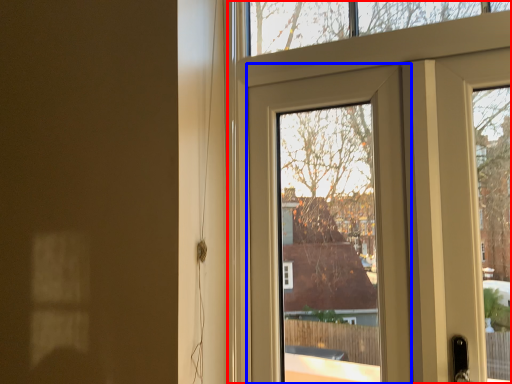
Question: Among these objects, which one is nearest to the camera, door (highlighted by a red box) or door (highlighted by a blue box)?

Choices:
 (A) door
 (B) door

Answer: (A)